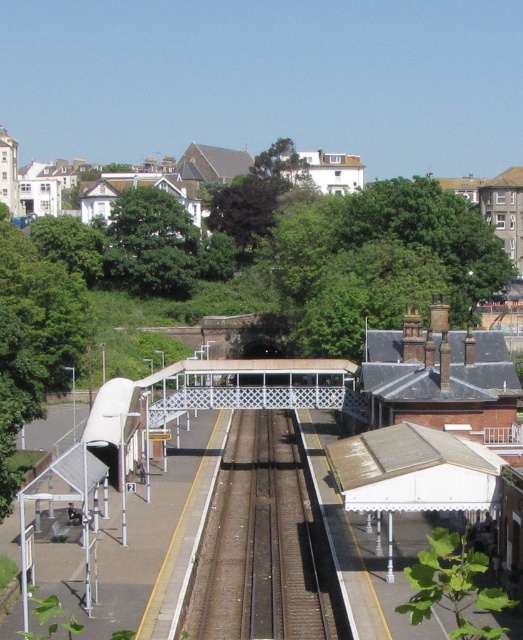
You are standing at the entrance of the railway station and want to find the white textured canopy at center. Based on its 2D coordinates, in which direction should you look to see it?

The white textured canopy at center is located at point (337,403) in 2D coordinates, so you should look towards the central area of the image to see it.

You are a maintenance worker checking the railway tracks. You need to place a 2 meter wide equipment on the smooth metal train track at center. Can the metallic silver train at left pass through the track while the equipment is placed there?

The smooth metal train track at center is wider than the metallic silver train at left. Since the equipment is 2 meters wide, it can be placed on the track without blocking the entire width, allowing the train to pass safely.